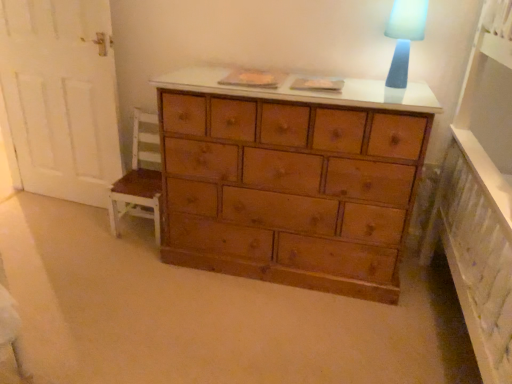
Question: Is white painted wood chair at left behind blue fabric lampshade at upper right?

Choices:
 (A) no
 (B) yes

Answer: (B)

Question: Does white painted wood chair at left have a greater width compared to blue fabric lampshade at upper right?

Choices:
 (A) no
 (B) yes

Answer: (B)

Question: Can you confirm if white painted wood chair at left is positioned to the left of blue fabric lampshade at upper right?

Choices:
 (A) yes
 (B) no

Answer: (A)

Question: Is white painted wood chair at left taller than blue fabric lampshade at upper right?

Choices:
 (A) yes
 (B) no

Answer: (A)

Question: Is white painted wood chair at left shorter than blue fabric lampshade at upper right?

Choices:
 (A) yes
 (B) no

Answer: (B)

Question: From the image's perspective, does white painted wood chair at left appear higher than blue fabric lampshade at upper right?

Choices:
 (A) yes
 (B) no

Answer: (B)

Question: Is blue fabric lampshade at upper right positioned in front of white painted wood chair at left?

Choices:
 (A) no
 (B) yes

Answer: (B)

Question: Is blue fabric lampshade at upper right positioned with its back to white painted wood chair at left?

Choices:
 (A) no
 (B) yes

Answer: (A)

Question: Is blue fabric lampshade at upper right positioned beyond the bounds of white painted wood chair at left?

Choices:
 (A) no
 (B) yes

Answer: (B)

Question: Could you tell me if blue fabric lampshade at upper right is facing white painted wood chair at left?

Choices:
 (A) no
 (B) yes

Answer: (A)

Question: Is blue fabric lampshade at upper right behind white painted wood chair at left?

Choices:
 (A) no
 (B) yes

Answer: (A)

Question: Considering the relative sizes of blue fabric lampshade at upper right and white painted wood chair at left in the image provided, is blue fabric lampshade at upper right shorter than white painted wood chair at left?

Choices:
 (A) no
 (B) yes

Answer: (B)

Question: Looking at the image, does blue fabric lampshade at upper right seem bigger or smaller compared to white painted wood chair at left?

Choices:
 (A) small
 (B) big

Answer: (A)